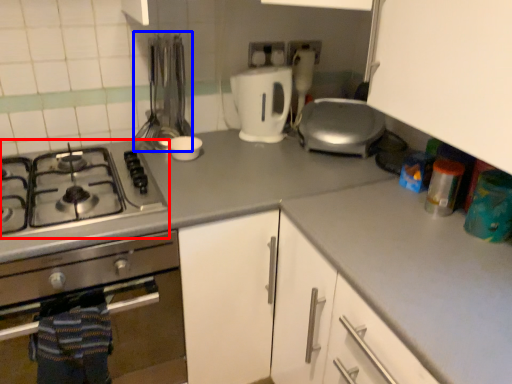
Question: Among these objects, which one is nearest to the camera, gas stove (highlighted by a red box) or silverware (highlighted by a blue box)?

Choices:
 (A) gas stove
 (B) silverware

Answer: (A)